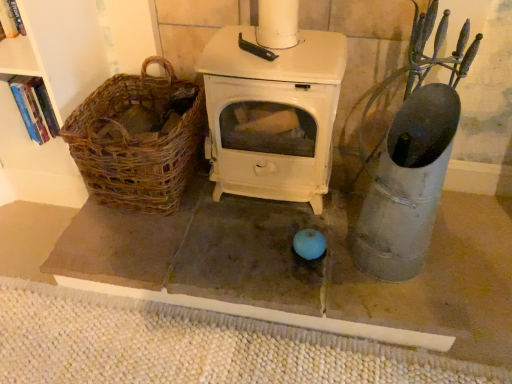
Question: Is woven beige mat at lower center positioned with its back to woven brown basket at left?

Choices:
 (A) yes
 (B) no

Answer: (B)

Question: Is woven beige mat at lower center facing towards woven brown basket at left?

Choices:
 (A) yes
 (B) no

Answer: (B)

Question: Can you confirm if woven beige mat at lower center is thinner than woven brown basket at left?

Choices:
 (A) no
 (B) yes

Answer: (A)

Question: Are woven beige mat at lower center and woven brown basket at left located far from each other?

Choices:
 (A) yes
 (B) no

Answer: (B)

Question: Considering the relative sizes of woven beige mat at lower center and woven brown basket at left in the image provided, is woven beige mat at lower center smaller than woven brown basket at left?

Choices:
 (A) no
 (B) yes

Answer: (B)

Question: Is woven beige mat at lower center not within woven brown basket at left?

Choices:
 (A) no
 (B) yes

Answer: (B)

Question: Is woven brown basket at left completely or partially outside of woven beige mat at lower center?

Choices:
 (A) no
 (B) yes

Answer: (B)

Question: Is woven brown basket at left turned away from woven beige mat at lower center?

Choices:
 (A) no
 (B) yes

Answer: (A)

Question: Can you confirm if woven brown basket at left is positioned to the right of woven beige mat at lower center?

Choices:
 (A) no
 (B) yes

Answer: (A)

Question: Would you say woven beige mat at lower center is part of woven brown basket at left's contents?

Choices:
 (A) no
 (B) yes

Answer: (A)

Question: From a real-world perspective, is woven brown basket at left physically above woven beige mat at lower center?

Choices:
 (A) no
 (B) yes

Answer: (B)

Question: From a real-world perspective, is woven brown basket at left below woven beige mat at lower center?

Choices:
 (A) yes
 (B) no

Answer: (B)

Question: Does point pos(129,347) appear closer or farther from the camera than point pos(168,74)?

Choices:
 (A) farther
 (B) closer

Answer: (B)